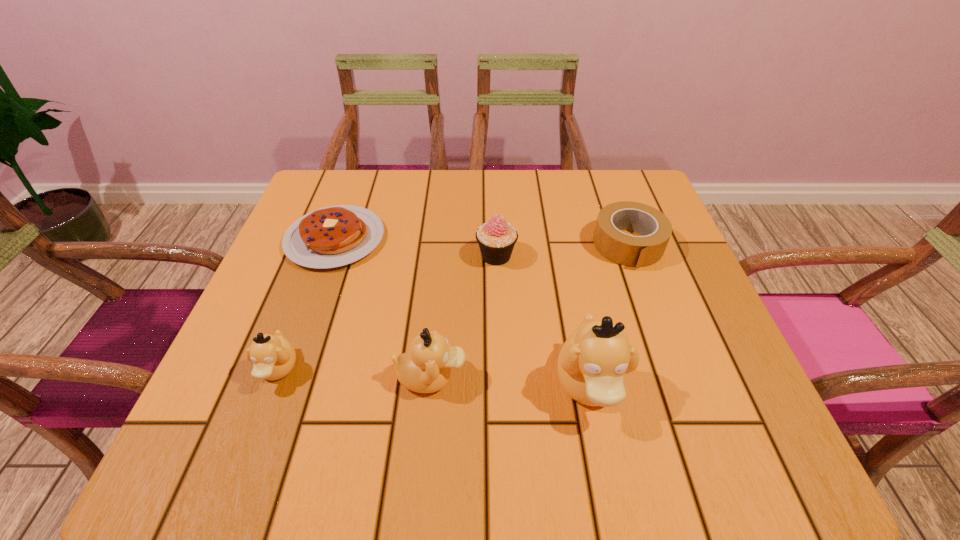
Identify the location of vacant space in between the cupcake and the tallest object. The width and height of the screenshot is (960, 540). (542, 320).

Identify the location of free space that is in between the pancake and the cupcake. (416, 247).

This screenshot has height=540, width=960. In order to click on free space that is in between the second shortest duckling and the third shortest object in this screenshot , I will do `click(354, 373)`.

Where is `unoccupied position between the fifth tallest object and the third object from left to right`? The image size is (960, 540). unoccupied position between the fifth tallest object and the third object from left to right is located at coordinates (530, 311).

Locate an element on the screen. This screenshot has width=960, height=540. unoccupied area between the leftmost duckling and the second duckling from right to left is located at coordinates (354, 373).

Where is `free space between the shortest object and the cupcake`? This screenshot has height=540, width=960. free space between the shortest object and the cupcake is located at coordinates (416, 247).

Where is `object that is the fifth closest one to the shortest object`? The width and height of the screenshot is (960, 540). object that is the fifth closest one to the shortest object is located at coordinates (634, 251).

This screenshot has height=540, width=960. Identify the location of object that stands as the fourth closest to the tallest duckling. (333, 236).

Identify the location of duckling that can be found as the closest to the tallest object. The height and width of the screenshot is (540, 960). (426, 368).

Where is `the closest duckling relative to the second shortest object`? The image size is (960, 540). the closest duckling relative to the second shortest object is located at coordinates (592, 365).